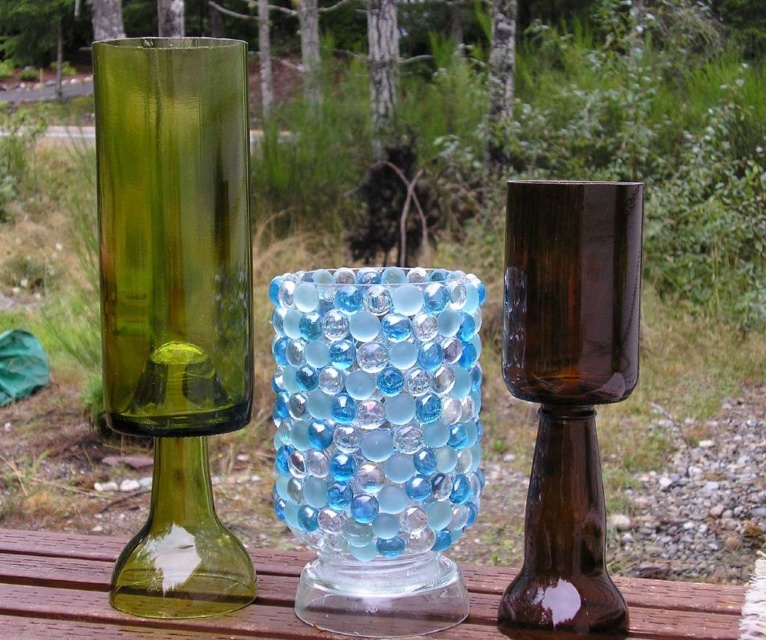
Which of these two, green glass vase at left or brown glass goblet at center, stands shorter?

brown glass goblet at center is shorter.

Can you confirm if green glass vase at left is positioned to the left of brown glass goblet at center?

Indeed, green glass vase at left is positioned on the left side of brown glass goblet at center.

Between point (249, 262) and point (499, 612), which one is positioned in front?

Point (499, 612) is in front.

The image size is (766, 640). Identify the location of green glass vase at left. (175, 301).

Can you confirm if translucent blue glass vase at center is positioned to the left of brown glass goblet at center?

Indeed, translucent blue glass vase at center is positioned on the left side of brown glass goblet at center.

Between translucent blue glass vase at center and brown glass goblet at center, which one appears on the right side from the viewer's perspective?

Positioned to the right is brown glass goblet at center.

This screenshot has width=766, height=640. Identify the location of translucent blue glass vase at center. (377, 442).

Does green glass vase at left have a lesser height compared to transparent glass table at center?

No, green glass vase at left is not shorter than transparent glass table at center.

Between green glass vase at left and transparent glass table at center, which one appears on the left side from the viewer's perspective?

From the viewer's perspective, green glass vase at left appears more on the left side.

Does point (221, 536) come farther from viewer compared to point (84, 561)?

No.

The image size is (766, 640). Find the location of `green glass vase at left`. green glass vase at left is located at coordinates (175, 301).